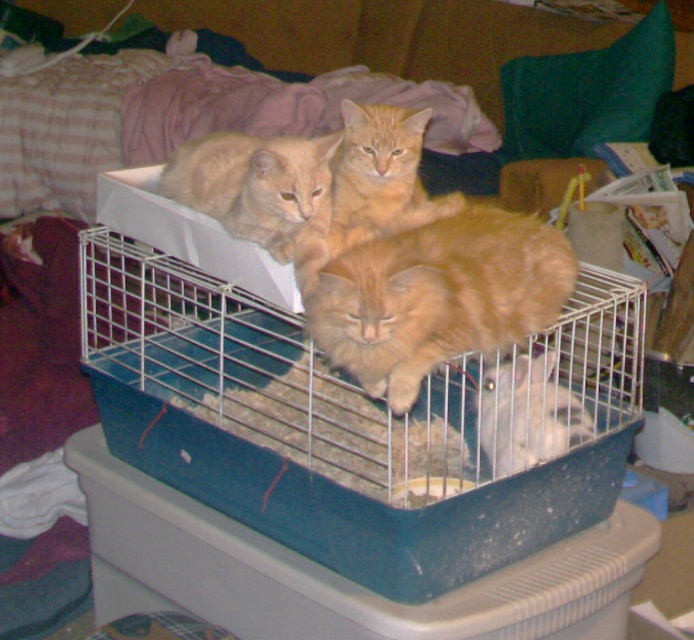
Is fluffy orange cat at center to the right of orange fur cat at center from the viewer's perspective?

Indeed, fluffy orange cat at center is positioned on the right side of orange fur cat at center.

Is fluffy orange cat at center above orange fur cat at center?

Actually, fluffy orange cat at center is below orange fur cat at center.

Is point (566, 244) less distant than point (459, 200)?

That is True.

This screenshot has width=694, height=640. I want to click on fluffy orange cat at center, so click(x=437, y=296).

Is blue plastic bird cage at center closer to the viewer compared to orange fur cat at center?

Yes, it is.

Who is more forward, [314,513] or [416,147]?

Positioned in front is point [314,513].

The width and height of the screenshot is (694, 640). Find the location of `blue plastic bird cage at center`. blue plastic bird cage at center is located at coordinates (341, 424).

Can you confirm if blue plastic bird cage at center is smaller than fluffy orange cat at center?

Actually, blue plastic bird cage at center might be larger than fluffy orange cat at center.

Can you confirm if blue plastic bird cage at center is positioned to the left of fluffy orange cat at center?

Indeed, blue plastic bird cage at center is positioned on the left side of fluffy orange cat at center.

Which is in front, point (103, 385) or point (347, 282)?

Point (347, 282) is more forward.

Identify the location of blue plastic bird cage at center. (341, 424).